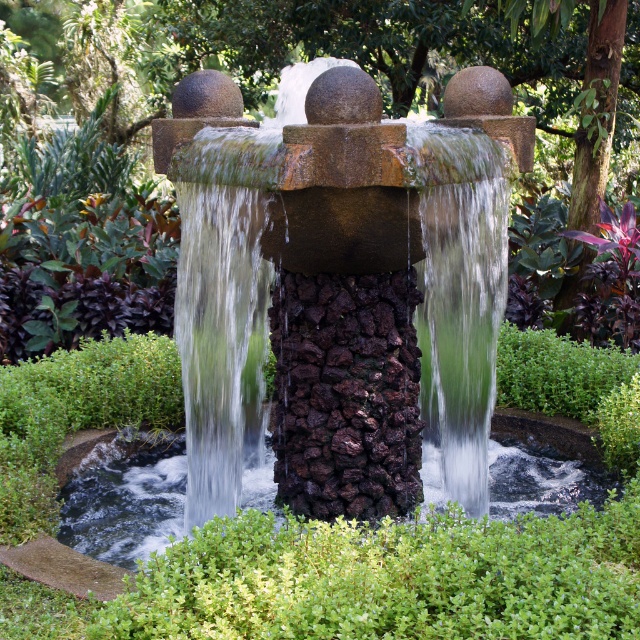
You are a landscape architect designing a new garden layout. You need to place a decorative statue that requires a stable base. Given the scene, which object between the smooth stone fountain at center and the clear water at center would be more suitable for placing the statue?

The smooth stone fountain at center is positioned on the right side of clear water at center and is a solid structure, making it more suitable for placing the statue as it provides a stable base compared to the clear water at center.

You are standing in the garden and want to take a photo of the smooth stone fountain at center. If your camera can focus on objects up to 4 meters away, will you need to move closer or farther away to capture a clear photo?

The smooth stone fountain at center is 4.14 meters away from you, which is beyond the camera focus range of 4 meters. Therefore, you need to move closer to ensure the camera can focus properly.